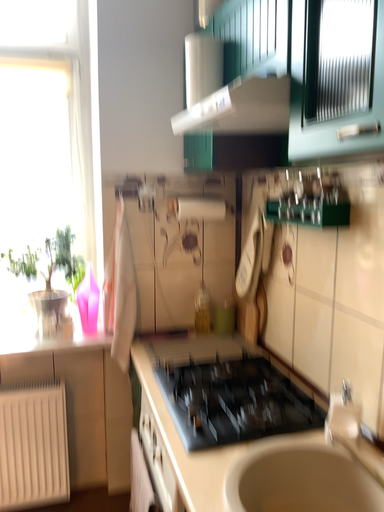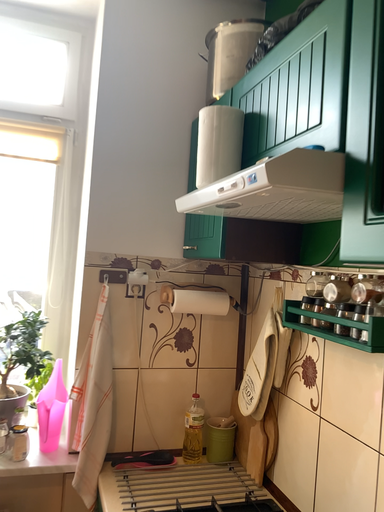
Question: How did the camera likely rotate when shooting the video?

Choices:
 (A) rotated downward
 (B) rotated upward

Answer: (B)